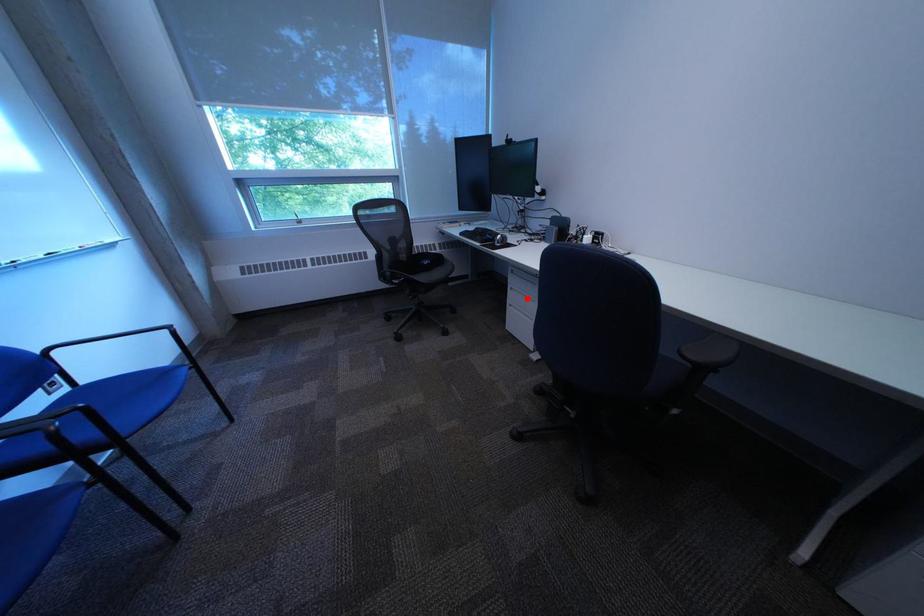
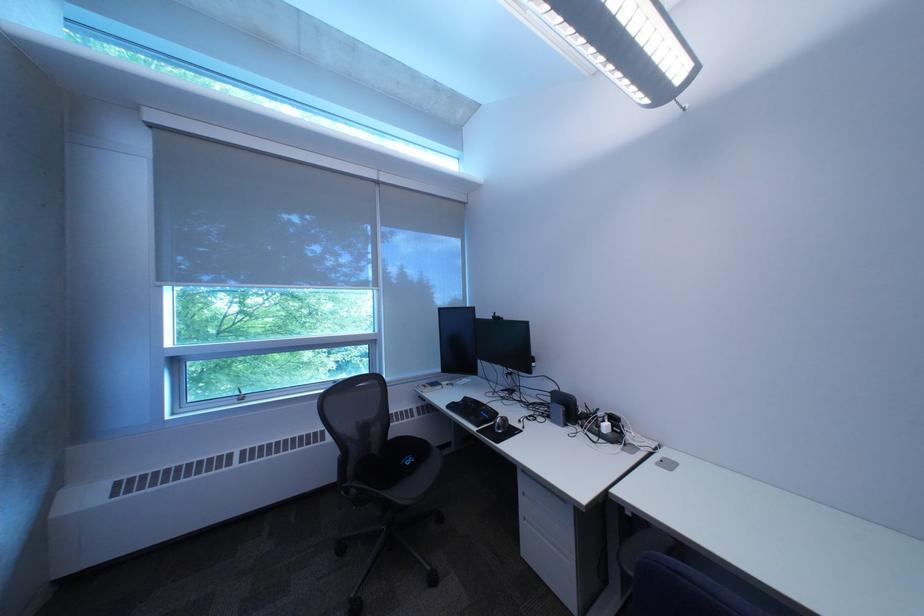
Locate, in the second image, the point that corresponds to the highlighted location in the first image.

(541, 506)